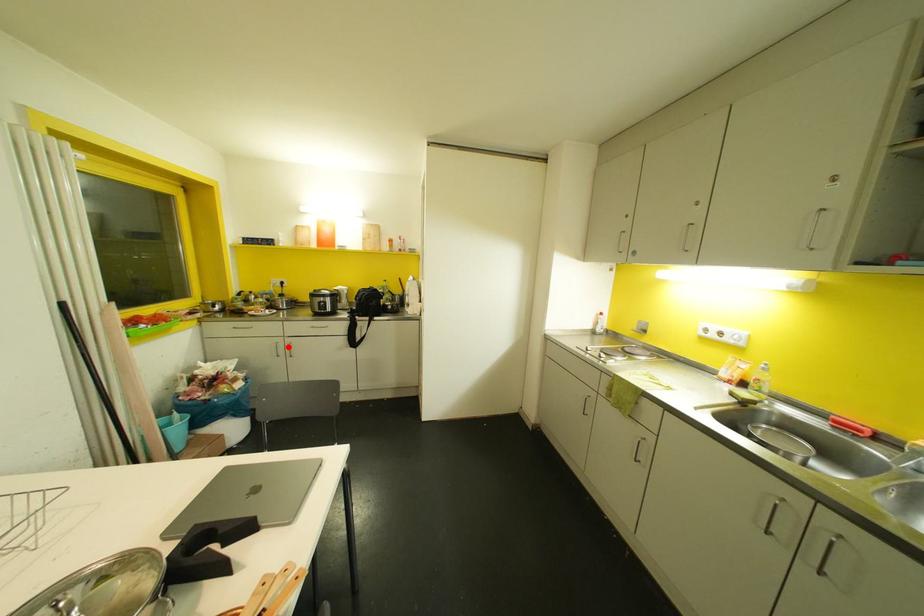
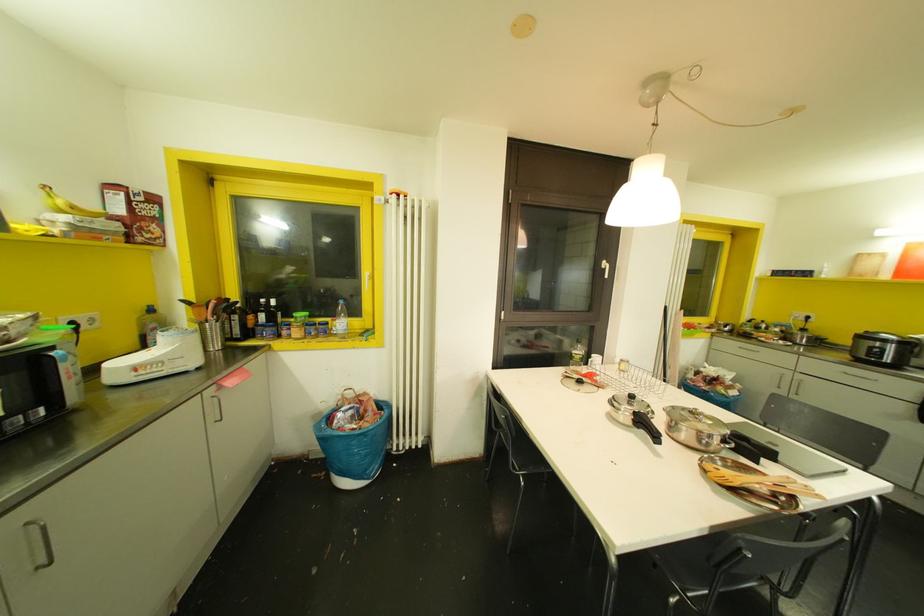
Where in the second image is the point corresponding to the highlighted location from the first image?

(796, 383)